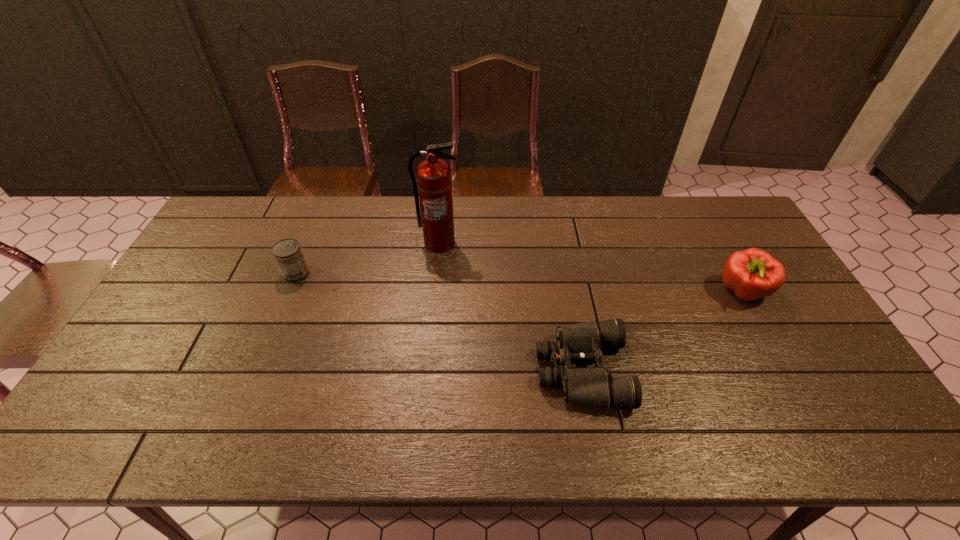
Where is `the tallest object`? This screenshot has width=960, height=540. the tallest object is located at coordinates (434, 182).

You are a GUI agent. You are given a task and a screenshot of the screen. Output one action in this format:
    pyautogui.click(x=<x>, y=<y>)
    Task: Click on the fire extinguisher
    The image size is (960, 540).
    Given the screenshot: What is the action you would take?
    pyautogui.click(x=434, y=182)

You are a GUI agent. You are given a task and a screenshot of the screen. Output one action in this format:
    pyautogui.click(x=<x>, y=<y>)
    Task: Click on the rightmost object
    This screenshot has width=960, height=540.
    Given the screenshot: What is the action you would take?
    pyautogui.click(x=753, y=273)

Image resolution: width=960 pixels, height=540 pixels. I want to click on the third shortest object, so click(x=753, y=273).

Locate an element on the screen. The height and width of the screenshot is (540, 960). the second shortest object is located at coordinates (288, 254).

At what (x,y) coordinates should I click in order to perform the action: click on can. Please return your answer as a coordinate pair (x, y). The width and height of the screenshot is (960, 540). Looking at the image, I should click on (288, 254).

Where is `the second object from right to left`? The height and width of the screenshot is (540, 960). the second object from right to left is located at coordinates (579, 342).

I want to click on the nearest object, so click(579, 342).

Where is `free space located on the nozzle side of the third object from right to left`? The height and width of the screenshot is (540, 960). free space located on the nozzle side of the third object from right to left is located at coordinates (437, 269).

Locate an element on the screen. The image size is (960, 540). free location located 0.360m on the left of the bell pepper is located at coordinates (597, 292).